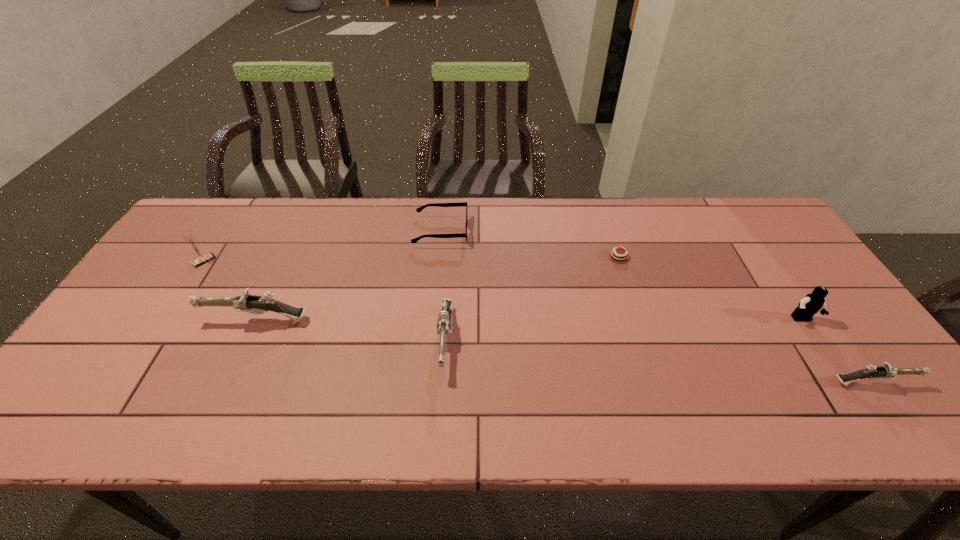
Locate an element on the screen. the second object from left to right is located at coordinates (253, 304).

Identify the location of the leftmost gun. The image size is (960, 540). (253, 304).

What are the coordinates of `the second gun from right to left` in the screenshot? It's located at (444, 322).

You are a GUI agent. You are given a task and a screenshot of the screen. Output one action in this format:
    pyautogui.click(x=<x>, y=<y>)
    Task: Click on the fourth shortest object
    The image size is (960, 540).
    Given the screenshot: What is the action you would take?
    pyautogui.click(x=444, y=322)

Find the location of a particular element. the rightmost gun is located at coordinates (886, 371).

Identify the location of the third shortest object. (886, 371).

Identify the location of the leftmost object. (201, 258).

At what (x,y) coordinates should I click in order to perform the action: click on spectacles. Please return your answer as a coordinate pair (x, y). This screenshot has width=960, height=540. Looking at the image, I should click on (419, 209).

Locate an element on the screen. The width and height of the screenshot is (960, 540). Lego is located at coordinates (811, 303).

Identify the location of the fifth object from left to right. (617, 256).